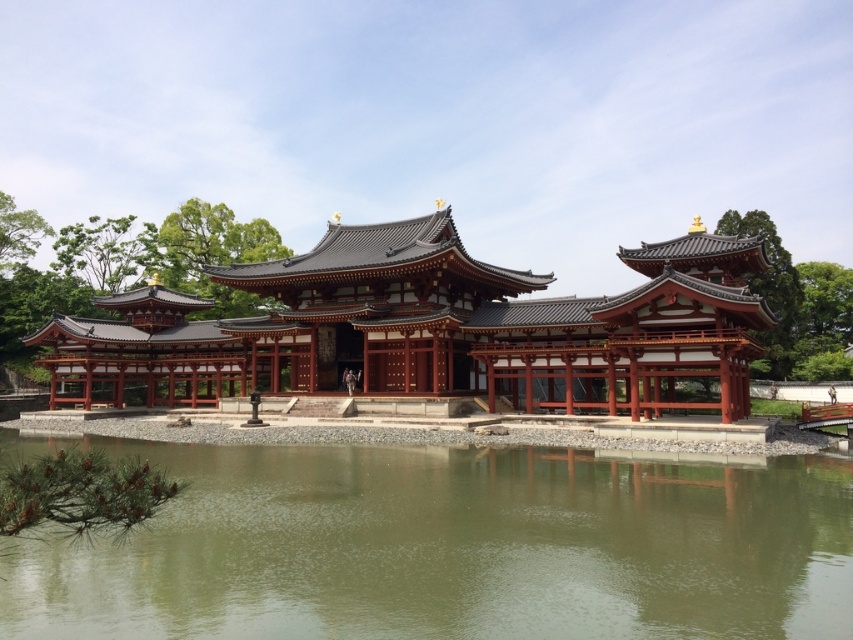
You are standing on the platform in front of the temple and want to take a photo of the shiny lacquered wooden pagoda at center and its reflection in the green reflective water at center. Which object should you focus on first to capture both the pagoda and its reflection clearly?

You should focus on the shiny lacquered wooden pagoda at center first because the green reflective water at center is located below it, ensuring the reflection will be in the same frame when centered on the pagoda.

You are a photographer planning to capture the entire structure of the shiny lacquered wooden pagoda at center and the green reflective water at center in a single shot. Based on the scene, will you need to adjust your camera angle to include both objects fully?

The green reflective water at center occupies less space than the shiny lacquered wooden pagoda at center, so you can capture both in a single shot without needing to adjust the camera angle significantly.

You are standing at the entrance of the temple and want to find the green reflective water at center. According to the coordinates provided, in which direction should you look to see it?

The green reflective water at center is located at coordinates point (451, 548). Since the coordinates are based on the image plane where the center is at (426, 320), the water is positioned to the right and slightly below the center. Therefore, you should look to your right and slightly downward from the central point to locate the green reflective water at center.